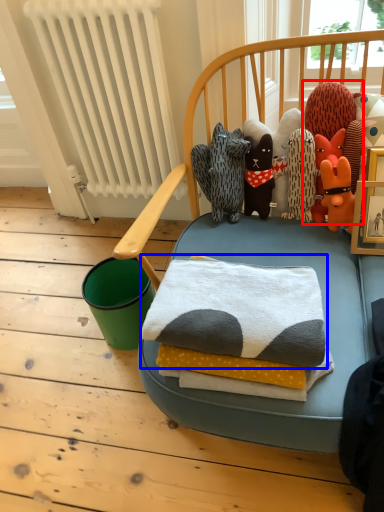
Question: Which object is further to the camera taking this photo, toy (highlighted by a red box) or bath towel (highlighted by a blue box)?

Choices:
 (A) toy
 (B) bath towel

Answer: (A)